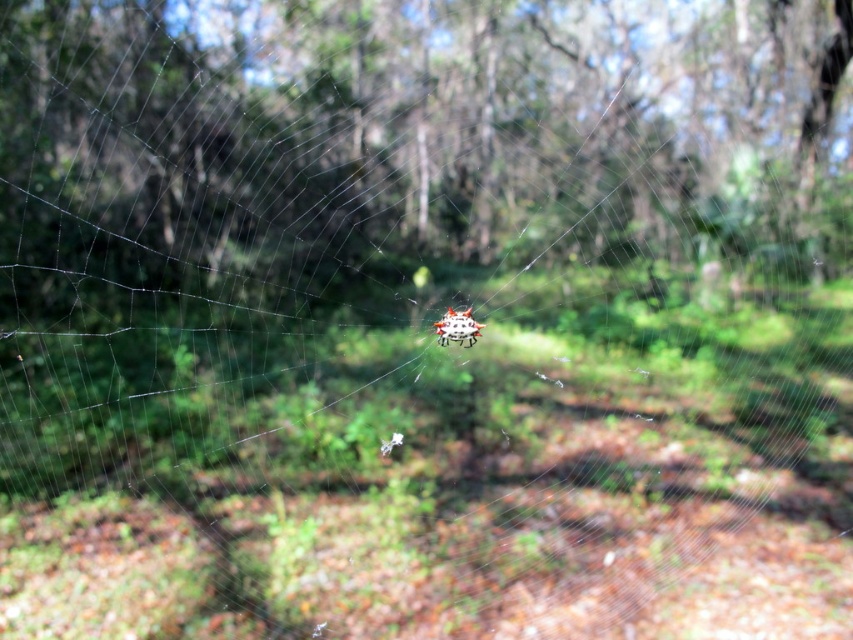
Is green leafy tree at center below translucent spiky orb at center?

Incorrect, green leafy tree at center is not positioned below translucent spiky orb at center.

Who is higher up, green leafy tree at center or translucent spiky orb at center?

Positioned higher is green leafy tree at center.

Describe the element at coordinates (444, 122) in the screenshot. Image resolution: width=853 pixels, height=640 pixels. I see `green leafy tree at center` at that location.

Locate an element on the screen. green leafy tree at center is located at coordinates (444, 122).